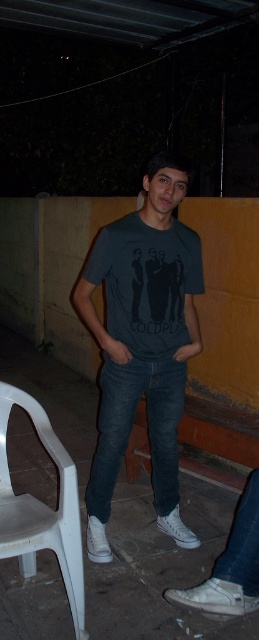
Is dark gray t-shirt at center below dark gray cotton t-shirt at center?

Correct, dark gray t-shirt at center is located below dark gray cotton t-shirt at center.

Describe the element at coordinates (142, 342) in the screenshot. The image size is (259, 640). I see `dark gray t-shirt at center` at that location.

Locate an element on the screen. Image resolution: width=259 pixels, height=640 pixels. dark gray t-shirt at center is located at coordinates (142, 342).

Does dark gray cotton t-shirt at center come in front of dark blue denim jeans at center?

Yes, it is in front of dark blue denim jeans at center.

Does dark gray cotton t-shirt at center appear on the right side of dark blue denim jeans at center?

Correct, you'll find dark gray cotton t-shirt at center to the right of dark blue denim jeans at center.

Measure the distance between point (149, 342) and camera.

Point (149, 342) is 8.03 feet from camera.

Identify the location of dark gray cotton t-shirt at center. The width and height of the screenshot is (259, 640). (146, 282).

Between dark gray t-shirt at center and white plastic chair at lower left, which one has less height?

Standing shorter between the two is white plastic chair at lower left.

In the scene shown: Who is more distant from viewer, (99, 490) or (16, 552)?

The point (99, 490) is more distant.

Locate an element on the screen. The height and width of the screenshot is (640, 259). dark gray t-shirt at center is located at coordinates (142, 342).